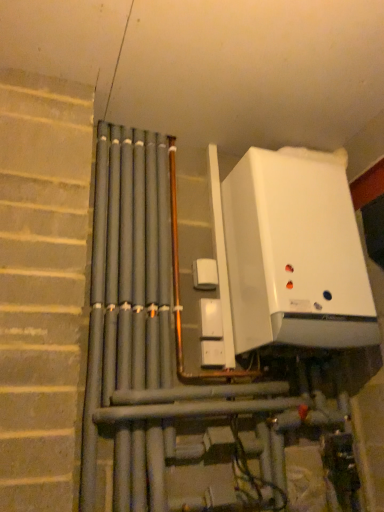
Question: Should I look upward or downward to see white glossy boiler at upper right?

Choices:
 (A) up
 (B) down

Answer: (B)